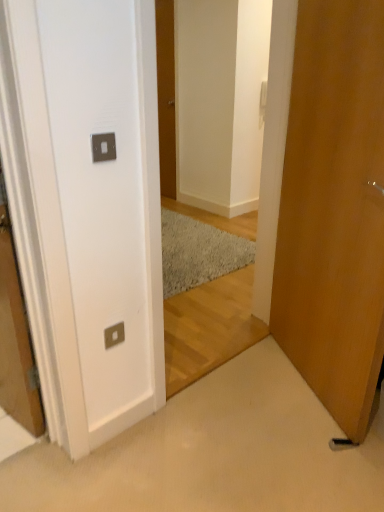
At what (x,y) coordinates should I click in order to perform the action: click on wooden door at right, which is the 2th door from left to right. Please return your answer as a coordinate pair (x, y). Looking at the image, I should click on (334, 210).

The image size is (384, 512). What are the coordinates of `wooden door at right, which is counted as the 1th door, starting from the bottom` in the screenshot? It's located at (334, 210).

Based on the photo, does satin silver switchplate at lower left have a larger size compared to wooden door at center, which ranks as the first door in top-to-bottom order?

No, satin silver switchplate at lower left is not bigger than wooden door at center, which ranks as the first door in top-to-bottom order.

Which is in front, point (112, 336) or point (162, 172)?

Point (112, 336)

Does point (168, 10) come behind point (351, 311)?

Yes, point (168, 10) is behind point (351, 311).

Is wooden door at center, placed as the first door when sorted from back to front, next to wooden door at right, arranged as the first door when viewed from the right?

No, wooden door at center, placed as the first door when sorted from back to front, is not with wooden door at right, arranged as the first door when viewed from the right.

Is wooden door at center, placed as the first door when sorted from back to front, taller or shorter than wooden door at right, acting as the second door starting from the top?

In the image, wooden door at center, placed as the first door when sorted from back to front, appears to be taller than wooden door at right, acting as the second door starting from the top.

Which of these two, wooden door at center, placed as the second door when sorted from front to back, or wooden door at right, the 1th door positioned from the front, is wider?

wooden door at right, the 1th door positioned from the front, is wider.

At what (x,y) coordinates should I click in order to perform the action: click on the 2nd door located above the satin silver switchplate at lower left (from a real-world perspective). Please return your answer as a coordinate pair (x, y). Image resolution: width=384 pixels, height=512 pixels. Looking at the image, I should click on (166, 95).

Could you tell me if wooden door at center, which ranks as the first door in top-to-bottom order, is turned towards satin silver switchplate at lower left?

No, wooden door at center, which ranks as the first door in top-to-bottom order, is not facing towards satin silver switchplate at lower left.

Is the position of wooden door at center, placed as the first door when sorted from back to front, more distant than that of satin silver switchplate at lower left?

That is True.

Is wooden door at center, placed as the first door when sorted from back to front, far from satin silver switchplate at lower left?

Yes, wooden door at center, placed as the first door when sorted from back to front, and satin silver switchplate at lower left are located far from each other.

Considering the sizes of objects wooden door at right, acting as the second door starting from the top, and wooden door at center, placed as the second door when sorted from front to back, in the image provided, who is bigger, wooden door at right, acting as the second door starting from the top, or wooden door at center, placed as the second door when sorted from front to back,?

wooden door at right, acting as the second door starting from the top.

Considering the positions of objects wooden door at right, acting as the second door starting from the back, and wooden door at center, marked as the second door in a bottom-to-top arrangement, in the image provided, who is more to the right, wooden door at right, acting as the second door starting from the back, or wooden door at center, marked as the second door in a bottom-to-top arrangement,?

wooden door at right, acting as the second door starting from the back.

From a real-world perspective, which is physically below, wooden door at right, which is the 2th door from left to right, or wooden door at center, arranged as the second door when viewed from the right?

wooden door at right, which is the 2th door from left to right, from a real-world perspective.

From the image's perspective, is wooden door at right, arranged as the first door when viewed from the right, above wooden door at center, arranged as the second door when viewed from the right?

Actually, wooden door at right, arranged as the first door when viewed from the right, appears below wooden door at center, arranged as the second door when viewed from the right, in the image.

Is wooden door at right, acting as the second door starting from the top, thinner than satin silver switchplate at lower left?

Incorrect, the width of wooden door at right, acting as the second door starting from the top, is not less than that of satin silver switchplate at lower left.

Does wooden door at right, arranged as the first door when viewed from the right, contain satin silver switchplate at lower left?

Actually, satin silver switchplate at lower left is outside wooden door at right, arranged as the first door when viewed from the right.

How far apart are wooden door at right, acting as the second door starting from the top, and satin silver switchplate at lower left?

wooden door at right, acting as the second door starting from the top, and satin silver switchplate at lower left are 3.40 feet apart.

Locate an element on the screen. electric outlet lying behind the wooden door at right, the 1th door positioned from the front is located at coordinates (114, 335).

Which object is more forward, satin silver switchplate at lower left or wooden door at right, which is counted as the 1th door, starting from the bottom?

wooden door at right, which is counted as the 1th door, starting from the bottom.

Are satin silver switchplate at lower left and wooden door at right, arranged as the first door when viewed from the right, beside each other?

No, satin silver switchplate at lower left is not in contact with wooden door at right, arranged as the first door when viewed from the right.

Which is more to the left, satin silver switchplate at lower left or wooden door at right, acting as the second door starting from the top?

satin silver switchplate at lower left is more to the left.

Identify the location of the 2nd door positioned above the satin silver switchplate at lower left (from the image's perspective). The height and width of the screenshot is (512, 384). (166, 95).

Locate an element on the screen. door lying on the left of wooden door at right, acting as the second door starting from the back is located at coordinates (166, 95).

Which object lies nearer to the anchor point wooden door at right, arranged as the first door when viewed from the right, wooden door at center, marked as the second door in a bottom-to-top arrangement, or satin silver switchplate at lower left?

satin silver switchplate at lower left lies closer to wooden door at right, arranged as the first door when viewed from the right, than the other object.

Which object lies nearer to the anchor point wooden door at center, which ranks as the first door in top-to-bottom order, satin silver switchplate at lower left or wooden door at right, which is the 2th door from left to right?

wooden door at right, which is the 2th door from left to right, lies closer to wooden door at center, which ranks as the first door in top-to-bottom order, than the other object.

Considering their positions, is satin silver switchplate at lower left positioned closer to wooden door at right, acting as the second door starting from the top, than wooden door at center, placed as the first door when sorted from back to front?

Based on the image, satin silver switchplate at lower left appears to be nearer to wooden door at right, acting as the second door starting from the top.

Looking at the image, which one is located further to satin silver switchplate at lower left, wooden door at center, arranged as the second door when viewed from the right, or wooden door at right, arranged as the first door when viewed from the right?

wooden door at center, arranged as the second door when viewed from the right, is positioned further to the anchor satin silver switchplate at lower left.

Considering their positions, is wooden door at right, arranged as the first door when viewed from the right, positioned closer to satin silver switchplate at lower left than wooden door at center, which ranks as the first door in top-to-bottom order?

The object closer to satin silver switchplate at lower left is wooden door at right, arranged as the first door when viewed from the right.

When comparing their distances from wooden door at center, placed as the first door when sorted from back to front, does wooden door at right, acting as the second door starting from the back, or satin silver switchplate at lower left seem closer?

wooden door at right, acting as the second door starting from the back, is closer to wooden door at center, placed as the first door when sorted from back to front.

This screenshot has width=384, height=512. Identify the location of electric outlet positioned between wooden door at right, acting as the second door starting from the back, and wooden door at center, marked as the second door in a bottom-to-top arrangement, from near to far. (114, 335).